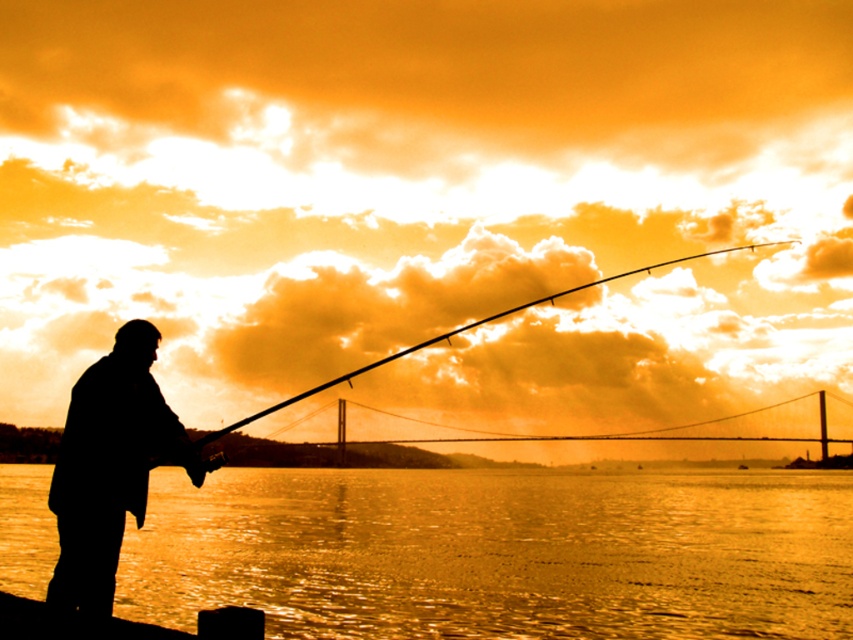
Question: Does silhouette fishing rod at left lie behind smooth black rod at center?

Choices:
 (A) no
 (B) yes

Answer: (A)

Question: Which object is the closest to the smooth black rod at center?

Choices:
 (A) silhouette fishing rod at left
 (B) golden reflective water at lower center

Answer: (A)

Question: Which object appears farthest from the camera in this image?

Choices:
 (A) silhouette fishing rod at left
 (B) smooth black rod at center
 (C) golden reflective water at lower center

Answer: (B)

Question: Which is nearer to the smooth black rod at center?

Choices:
 (A) smooth wood dock at lower left
 (B) golden reflective water at lower center

Answer: (B)

Question: Does silhouette fishing rod at left appear on the left side of smooth black rod at center?

Choices:
 (A) no
 (B) yes

Answer: (B)

Question: Is silhouette fishing rod at left above smooth black rod at center?

Choices:
 (A) yes
 (B) no

Answer: (B)